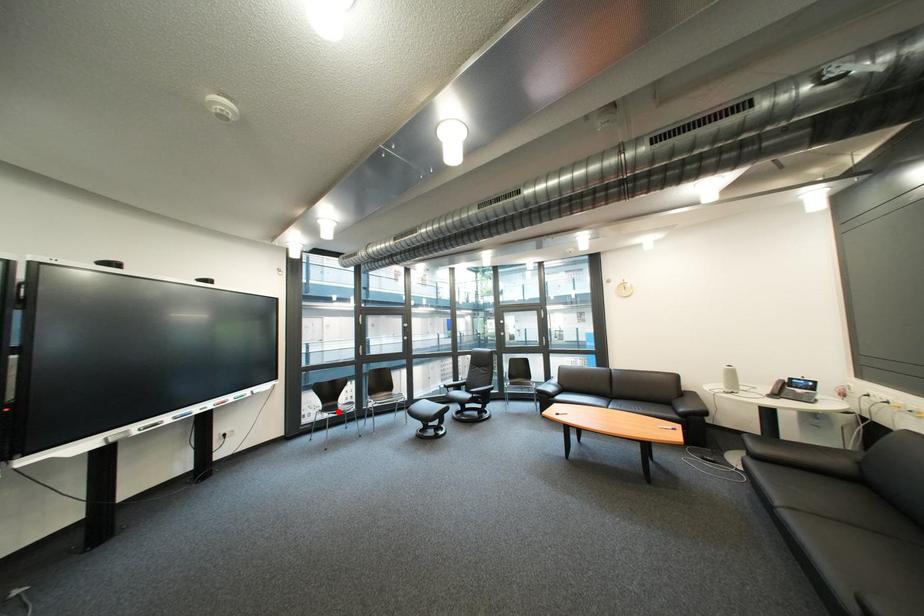
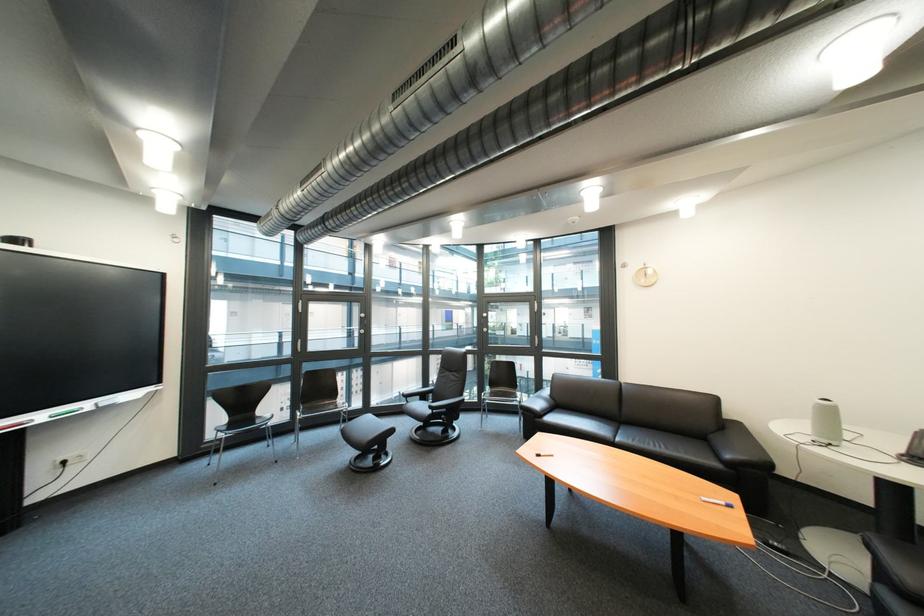
In the second image, find the point that corresponds to the highlighted location in the first image.

(246, 426)